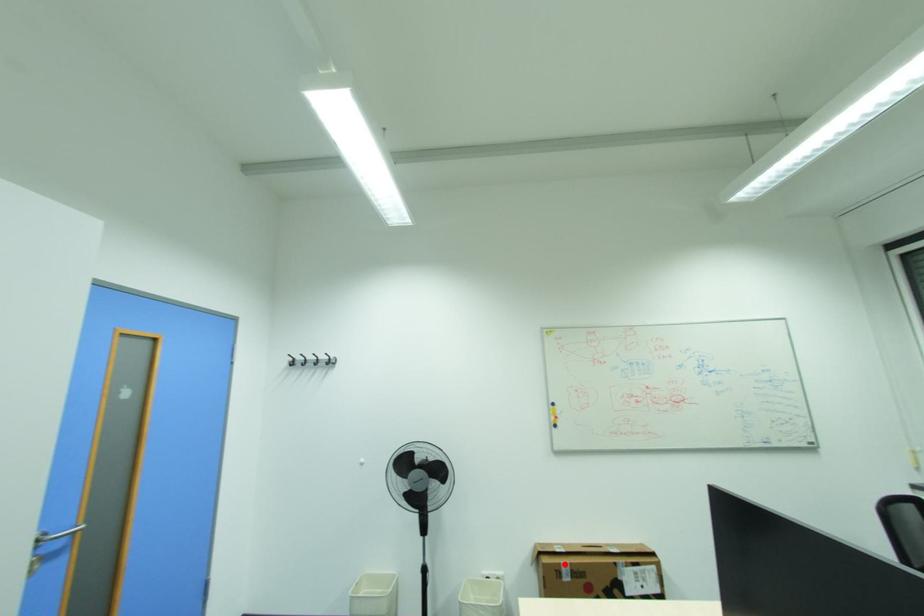
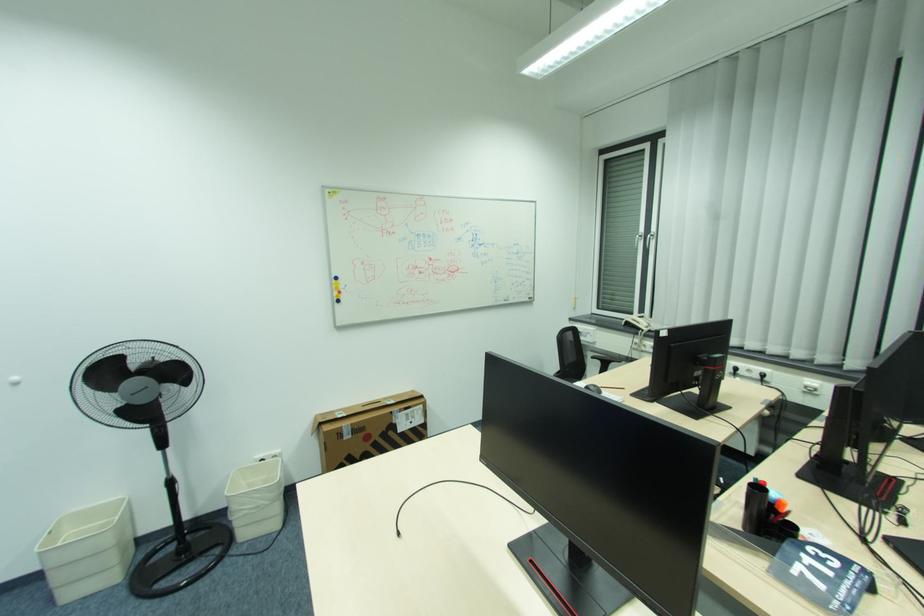
Where in the second image is the point corresponding to the highlighted location from the first image?

(346, 427)